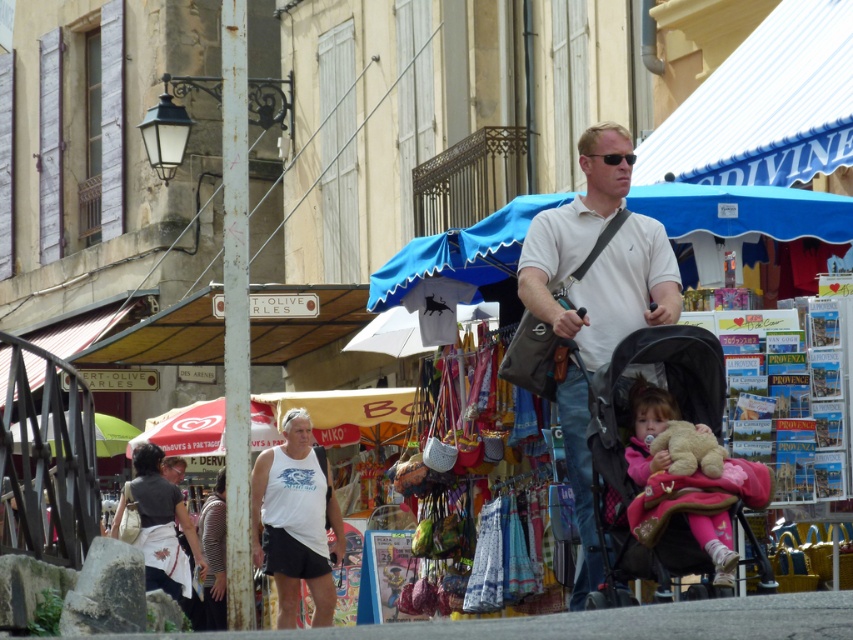
Question: Which point is farther to the camera?

Choices:
 (A) (288, 541)
 (B) (712, 557)
 (C) (531, 269)

Answer: (A)

Question: Which object is positioned closest to the pink fleece jacket at lower right?

Choices:
 (A) white cotton shirt at center
 (B) white matte tank top at center

Answer: (A)

Question: Does blue fabric canopy at center appear on the right side of pink fleece jacket at lower right?

Choices:
 (A) no
 (B) yes

Answer: (A)

Question: Which object is farther from the camera taking this photo?

Choices:
 (A) white cotton shirt at center
 (B) blue fabric canopy at center

Answer: (B)

Question: Does blue fabric canopy at center come behind pink fleece jacket at lower right?

Choices:
 (A) no
 (B) yes

Answer: (B)

Question: Does white cotton shirt at center appear on the right side of white matte tank top at center?

Choices:
 (A) no
 (B) yes

Answer: (B)